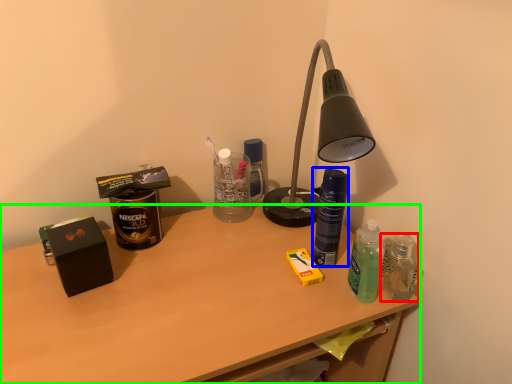
Question: Which object is positioned farthest from bottle (highlighted by a red box)? Select from bottle (highlighted by a blue box) and desk (highlighted by a green box).

Choices:
 (A) bottle
 (B) desk

Answer: (B)